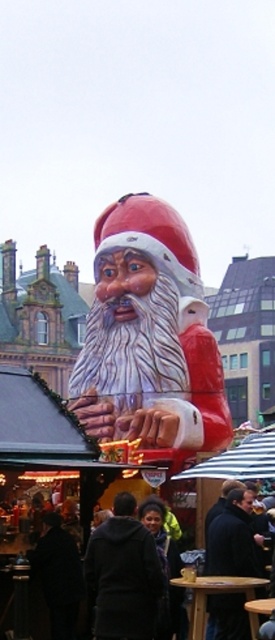
Looking at this image, you are standing at the entrance of the Christmas market and want to take a photo of the matte red santa claus at center. If the camera you are using has a focal length of 50mm and you are positioned at point coordinates of 0.0, 0.0, where should you aim your camera to capture the santa claus in the frame?

The matte red santa claus at center is located at point coordinates of (149, 336). To capture it in the frame, aim the camera towards those coordinates from your position at (0, 0). The focal length of 50mm will ensure the santa claus is in focus and centered properly.